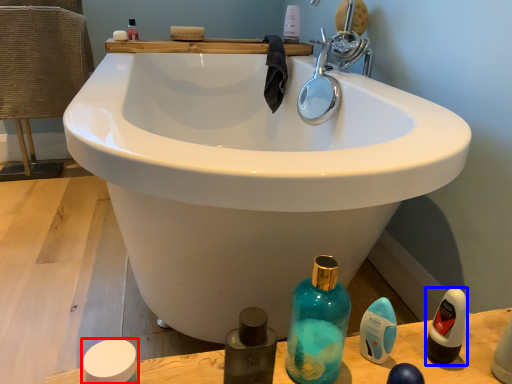
Question: Which object is closer to the camera taking this photo, mouthwash (highlighted by a red box) or mouthwash (highlighted by a blue box)?

Choices:
 (A) mouthwash
 (B) mouthwash

Answer: (A)